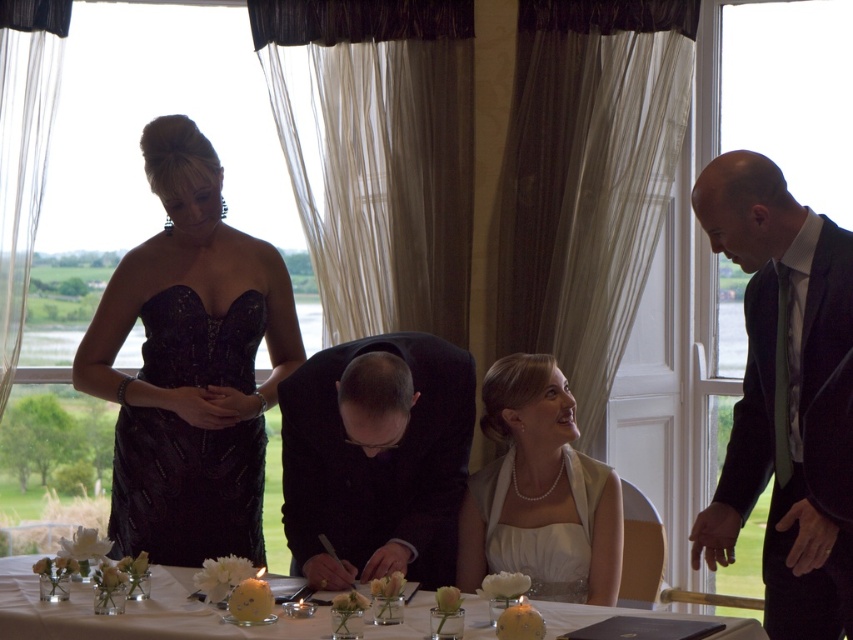
Does dark suit at right have a lesser width compared to pearl white dress at center?

Yes.

Is point (758, 296) positioned after point (497, 467)?

That is False.

What do you see at coordinates (779, 390) in the screenshot? I see `dark suit at right` at bounding box center [779, 390].

The width and height of the screenshot is (853, 640). In order to click on dark suit at right in this screenshot , I will do `click(779, 390)`.

What do you see at coordinates (779, 390) in the screenshot? I see `dark suit at right` at bounding box center [779, 390].

Between dark suit at right and black sequined cocktail dress at left, which one has more height?

Standing taller between the two is dark suit at right.

Which is in front, point (831, 276) or point (181, 317)?

Point (831, 276)

At what (x,y) coordinates should I click in order to perform the action: click on dark suit at right. Please return your answer as a coordinate pair (x, y). Looking at the image, I should click on (779, 390).

From the picture: Is black sequined dress at center bigger than white glass table at center?

Yes, black sequined dress at center is bigger than white glass table at center.

Is black sequined dress at center taller than white glass table at center?

Indeed, black sequined dress at center has a greater height compared to white glass table at center.

At what (x,y) coordinates should I click in order to perform the action: click on black sequined dress at center. Please return your answer as a coordinate pair (x, y). Looking at the image, I should click on (190, 364).